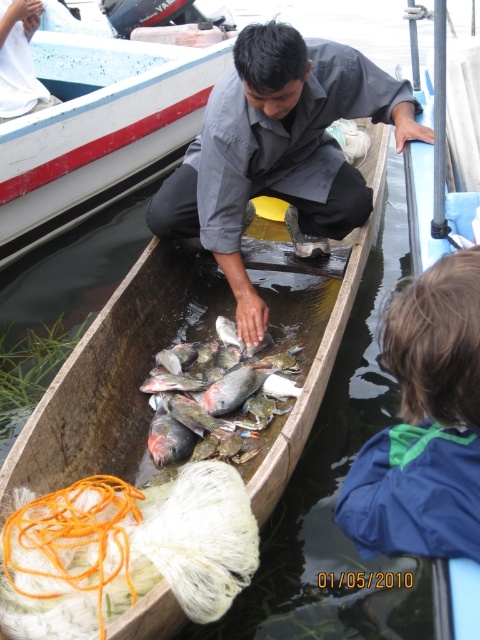
Between gray fabric shirt at center and shiny metallic fish at center, which one is positioned lower?

shiny metallic fish at center is lower down.

Is point (251, 323) farther from camera compared to point (220, 372)?

Yes, it is behind point (220, 372).

Describe the element at coordinates (278, 150) in the screenshot. I see `gray fabric shirt at center` at that location.

At what (x,y) coordinates should I click in order to perform the action: click on gray fabric shirt at center. Please return your answer as a coordinate pair (x, y). The image size is (480, 640). Looking at the image, I should click on (278, 150).

You are a GUI agent. You are given a task and a screenshot of the screen. Output one action in this format:
    pyautogui.click(x=<x>, y=<y>)
    Task: Click on the shiny silver fish at center
    This screenshot has width=480, height=640.
    Given the screenshot: What is the action you would take?
    pyautogui.click(x=236, y=387)

Is point (215, 397) more distant than point (152, 436)?

Yes.

The image size is (480, 640). Describe the element at coordinates (236, 387) in the screenshot. I see `shiny silver fish at center` at that location.

What are the coordinates of `shiny silver fish at center` in the screenshot? It's located at (236, 387).

Which is more to the right, wooden boat at center or blue fleece jacket at lower right?

From the viewer's perspective, blue fleece jacket at lower right appears more on the right side.

Measure the distance between point (x=58, y=125) and camera.

Point (x=58, y=125) and camera are 4.19 meters apart.

The height and width of the screenshot is (640, 480). What are the coordinates of `wooden boat at center` in the screenshot? It's located at (97, 129).